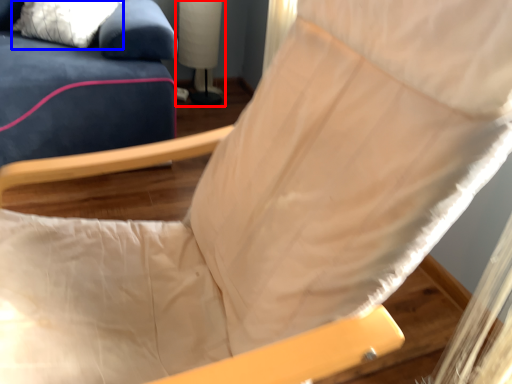
Question: Which of the following is the farthest to the observer, table lamp (highlighted by a red box) or pillow (highlighted by a blue box)?

Choices:
 (A) table lamp
 (B) pillow

Answer: (A)